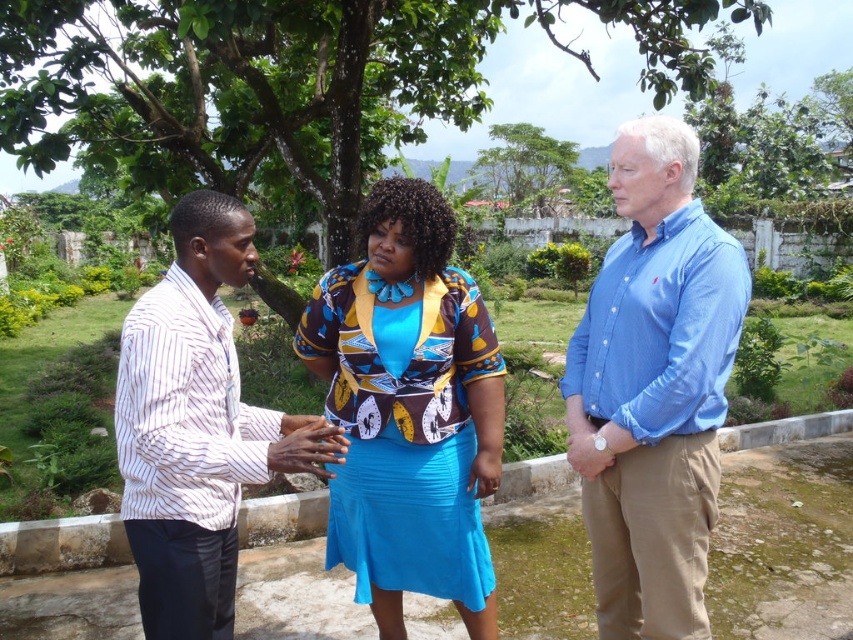
You are standing in the garden and want to take a photo of the green leafy tree at center. Your camera has a maximum focus range of 6 meters. Will the tree be in focus?

The green leafy tree at center is 5.91 meters away from the viewer, which is within the camera maximum focus range of 6 meters. So the tree will be in focus.

You are a photographer setting up for a group photo in the garden. You need to ensure that all subjects are visible. Given the blue fabric skirt at center and the white striped shirt at left, which one might require you to adjust your camera angle upwards to capture fully?

The blue fabric skirt at center has a greater height compared to the white striped shirt at left, so you would need to adjust the camera angle upwards to capture the blue fabric skirt at center fully.